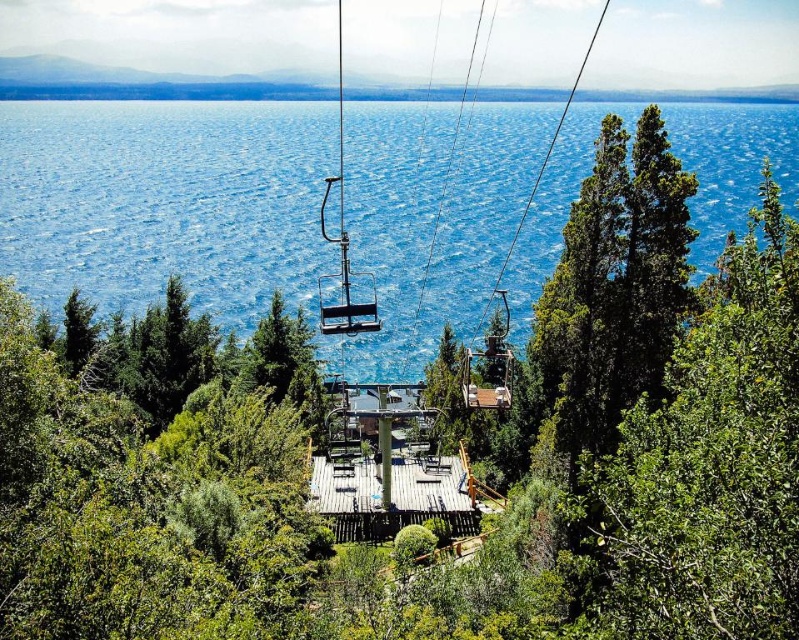
Question: Which point is farther to the camera?

Choices:
 (A) (756, 188)
 (B) (758, 518)
 (C) (352, 336)

Answer: (A)

Question: Can you confirm if blue water at center is positioned below green leafy tree at right?

Choices:
 (A) no
 (B) yes

Answer: (A)

Question: From the image, what is the correct spatial relationship of green leafy tree at right in relation to metallic silver ski lift at center?

Choices:
 (A) above
 (B) below

Answer: (B)

Question: Estimate the real-world distances between objects in this image. Which object is closer to the blue water at center?

Choices:
 (A) green leafy tree at right
 (B) metallic silver ski lift at center

Answer: (B)

Question: Which object is farther from the camera taking this photo?

Choices:
 (A) metallic silver ski lift at center
 (B) blue water at center

Answer: (B)

Question: Can you confirm if green leafy tree at right is thinner than metallic silver ski lift at center?

Choices:
 (A) yes
 (B) no

Answer: (A)